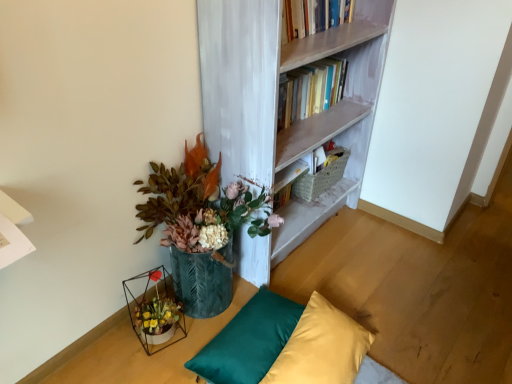
Question: In the image, is silky yellow pillow at lower center, placed as the 2th pillow when sorted from left to right, positioned in front of or behind metallic green vase at lower left?

Choices:
 (A) behind
 (B) front

Answer: (B)

Question: Which is correct: silky yellow pillow at lower center, which appears as the 1th pillow when viewed from the right, is inside metallic green vase at lower left, or outside of it?

Choices:
 (A) inside
 (B) outside

Answer: (B)

Question: Which of these objects is positioned closest to the metallic green vase at lower left?

Choices:
 (A) white painted wood bookcase at upper center
 (B) woven beige basket at upper center
 (C) silky yellow pillow at lower center, placed as the 2th pillow when sorted from left to right
 (D) teal satin pillow at lower center, the 1th pillow in the left-to-right sequence
 (E) metallic wire table at lower left

Answer: (A)

Question: Which is farther from the silky yellow pillow at lower center, placed as the 2th pillow when sorted from left to right?

Choices:
 (A) woven beige basket at upper center
 (B) metallic green vase at lower left
 (C) white painted wood bookcase at upper center
 (D) teal satin pillow at lower center, placed as the second pillow when sorted from right to left
 (E) metallic wire table at lower left

Answer: (A)